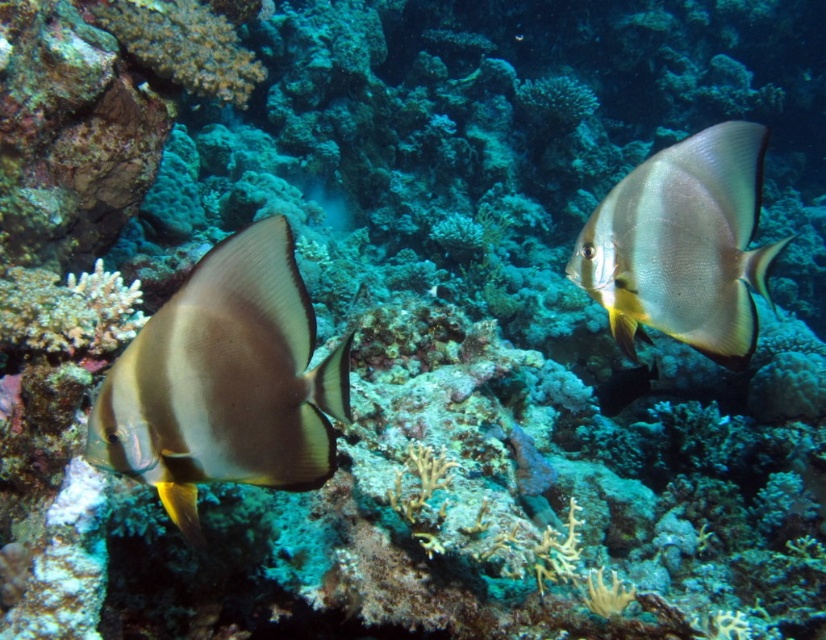
Question: Which point is farther to the camera?

Choices:
 (A) silvery matte batfish at upper right
 (B) matte silver fish at left

Answer: (A)

Question: Is matte silver fish at left positioned before silvery matte batfish at upper right?

Choices:
 (A) no
 (B) yes

Answer: (B)

Question: Which object appears closest to the camera in this image?

Choices:
 (A) silvery matte batfish at upper right
 (B) matte silver fish at left

Answer: (B)

Question: Among these points, which one is farthest from the camera?

Choices:
 (A) (307, 340)
 (B) (629, 241)

Answer: (B)

Question: Does matte silver fish at left lie behind silvery matte batfish at upper right?

Choices:
 (A) no
 (B) yes

Answer: (A)

Question: Is matte silver fish at left below silvery matte batfish at upper right?

Choices:
 (A) no
 (B) yes

Answer: (B)